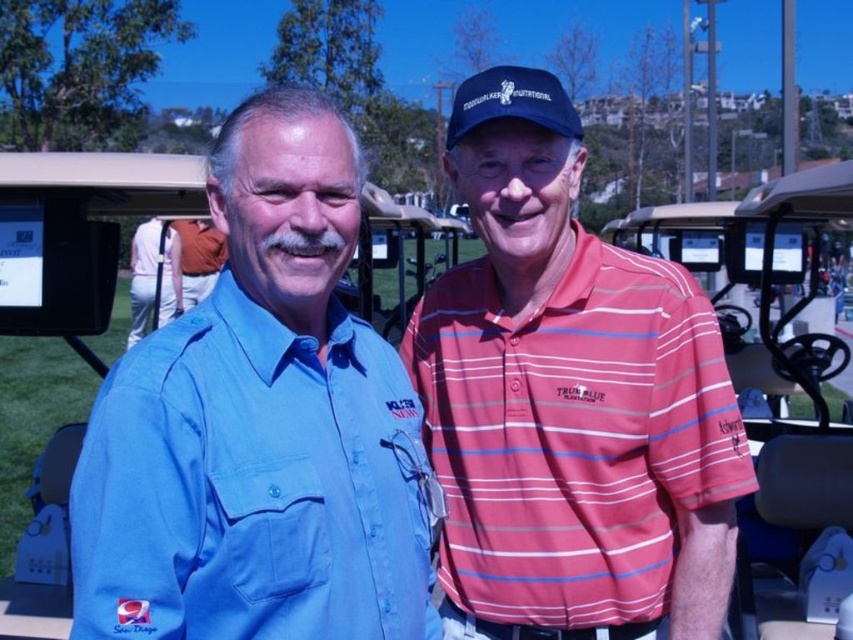
Question: Which point is farther to the camera?

Choices:
 (A) white cotton polo shirt at center
 (B) striped cotton polo shirt at center
 (C) matte black baseball cap at center
 (D) matte blue shirt at left

Answer: (A)

Question: Where is matte blue shirt at left located in relation to matte black baseball cap at center in the image?

Choices:
 (A) below
 (B) above

Answer: (A)

Question: Can you confirm if striped cotton polo shirt at center is positioned above matte black baseball cap at center?

Choices:
 (A) yes
 (B) no

Answer: (B)

Question: Which point is farther to the camera?

Choices:
 (A) pos(138,333)
 (B) pos(538,129)
 (C) pos(515,97)

Answer: (A)

Question: Which point appears closest to the camera in this image?

Choices:
 (A) (225, 131)
 (B) (158, 323)
 (C) (473, 632)
 (D) (521, 106)

Answer: (A)

Question: Does matte blue shirt at left have a lesser width compared to white cotton polo shirt at center?

Choices:
 (A) no
 (B) yes

Answer: (B)